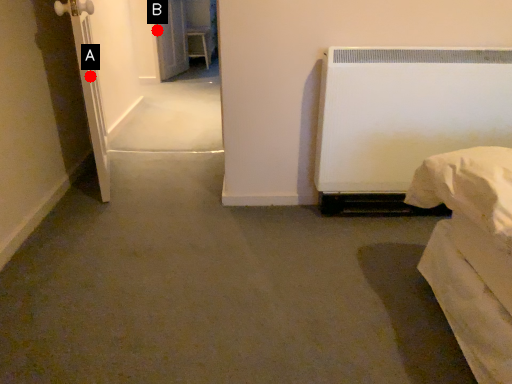
Question: Two points are circled on the image, labeled by A and B beside each circle. Which point is farther from the camera taking this photo?

Choices:
 (A) A is further
 (B) B is further

Answer: (B)